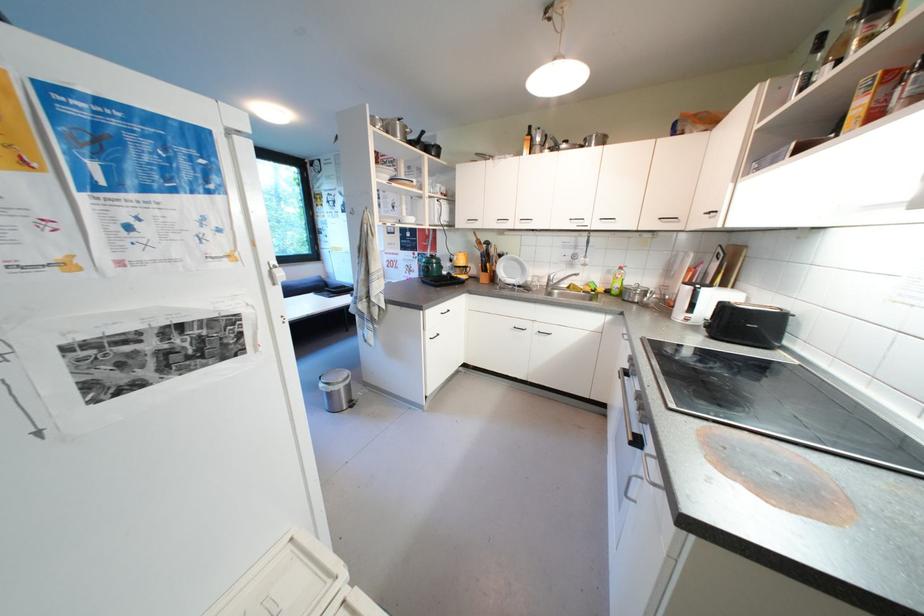
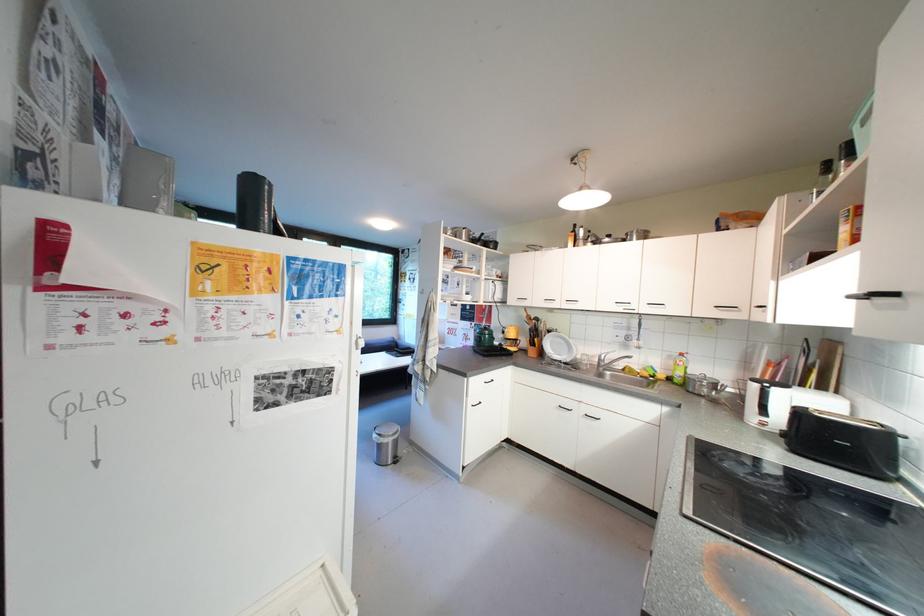
Find the pixel in the second image that matches point 438,334 in the first image.

(480, 402)